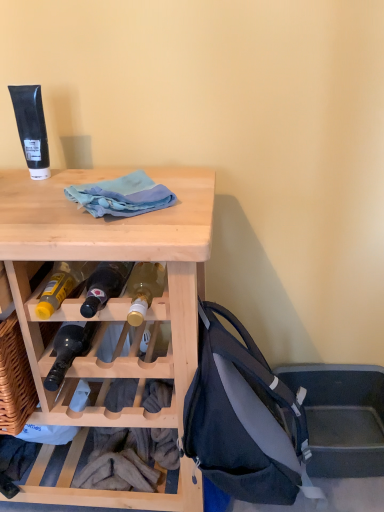
Question: Does light blue fabric at center come behind natural wood desk at upper left?

Choices:
 (A) yes
 (B) no

Answer: (A)

Question: Is light blue fabric at center thinner than natural wood desk at upper left?

Choices:
 (A) yes
 (B) no

Answer: (A)

Question: Considering the relative sizes of light blue fabric at center and natural wood desk at upper left in the image provided, is light blue fabric at center shorter than natural wood desk at upper left?

Choices:
 (A) yes
 (B) no

Answer: (A)

Question: Is light blue fabric at center in front of natural wood desk at upper left?

Choices:
 (A) yes
 (B) no

Answer: (B)

Question: From the image's perspective, does light blue fabric at center appear higher than natural wood desk at upper left?

Choices:
 (A) yes
 (B) no

Answer: (A)

Question: Considering the relative positions of matte black backpack at lower right and light blue fabric at center in the image provided, is matte black backpack at lower right to the left or to the right of light blue fabric at center?

Choices:
 (A) right
 (B) left

Answer: (A)

Question: From their relative heights in the image, would you say matte black backpack at lower right is taller or shorter than light blue fabric at center?

Choices:
 (A) tall
 (B) short

Answer: (A)

Question: Considering their positions, is matte black backpack at lower right located in front of or behind light blue fabric at center?

Choices:
 (A) behind
 (B) front

Answer: (B)

Question: From the image's perspective, is matte black backpack at lower right positioned above or below light blue fabric at center?

Choices:
 (A) below
 (B) above

Answer: (A)

Question: From the image's perspective, relative to natural wood desk at upper left, is matte black backpack at lower right above or below?

Choices:
 (A) below
 (B) above

Answer: (A)

Question: From a real-world perspective, is matte black backpack at lower right physically located above or below natural wood desk at upper left?

Choices:
 (A) below
 (B) above

Answer: (B)

Question: In terms of height, does matte black backpack at lower right look taller or shorter compared to natural wood desk at upper left?

Choices:
 (A) short
 (B) tall

Answer: (A)

Question: In terms of width, does matte black backpack at lower right look wider or thinner when compared to natural wood desk at upper left?

Choices:
 (A) wide
 (B) thin

Answer: (B)

Question: In terms of size, does natural wood desk at upper left appear bigger or smaller than matte black backpack at lower right?

Choices:
 (A) big
 (B) small

Answer: (A)

Question: Relative to matte black backpack at lower right, is natural wood desk at upper left in front or behind?

Choices:
 (A) behind
 (B) front

Answer: (B)